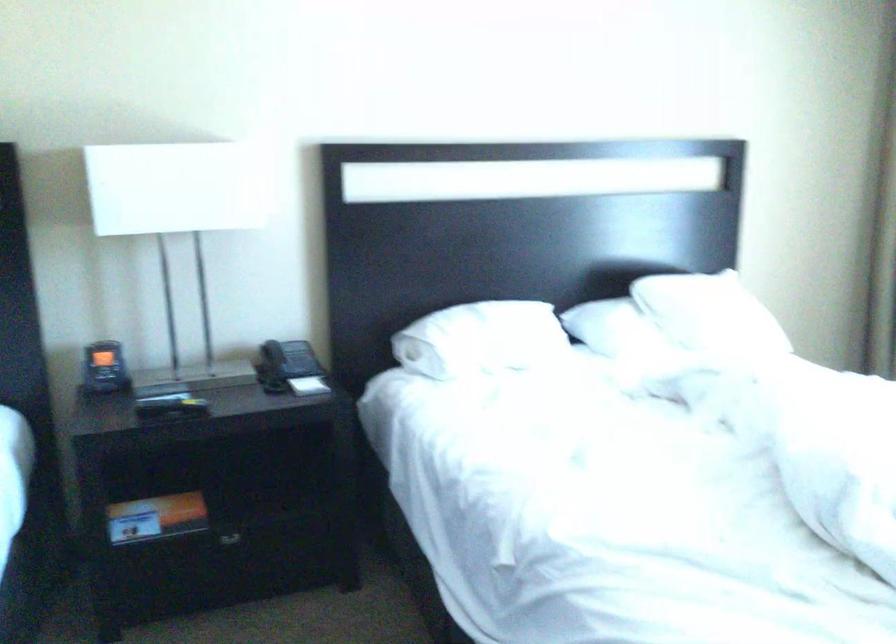
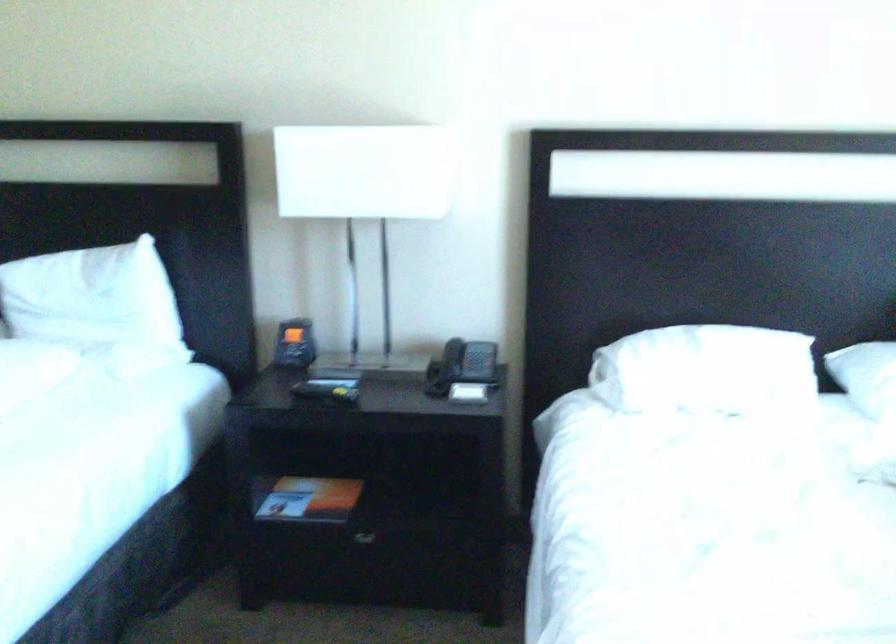
Question: How did the camera likely rotate?

Choices:
 (A) Left
 (B) Right
 (C) Up
 (D) Down

Answer: (A)